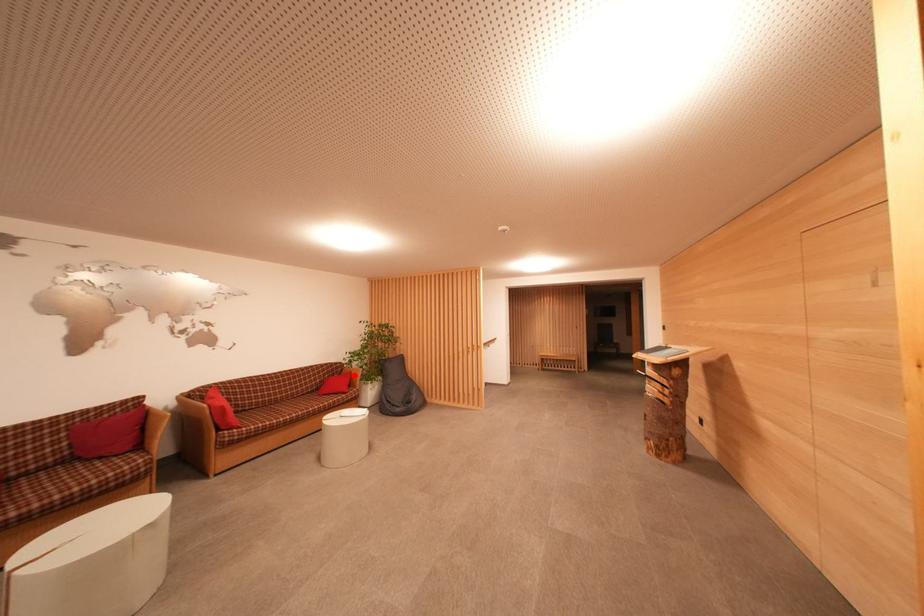
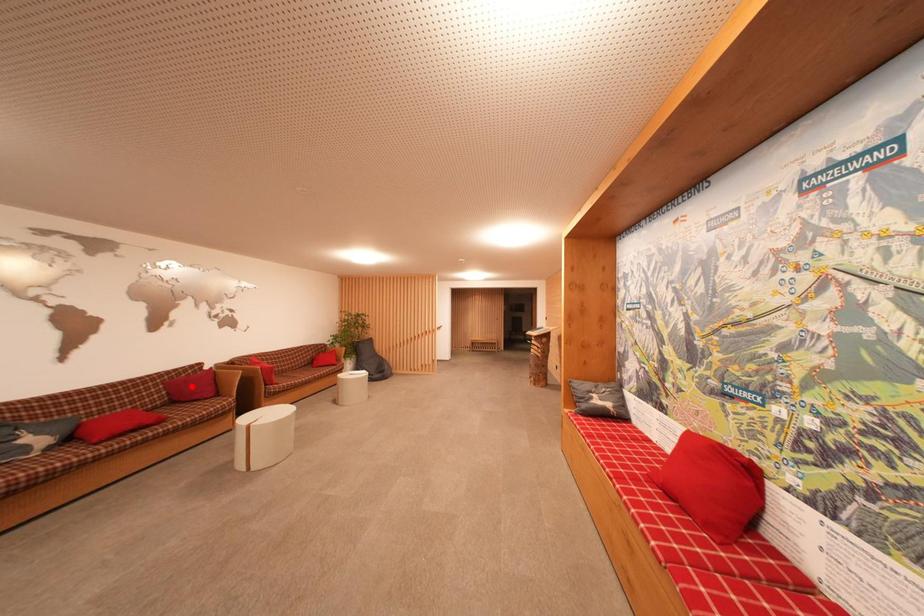
I am providing you with two images of the same scene from different viewpoints. A red point is marked on the first image and another point is marked on the second image. Is the marked point in image1 the same physical position as the marked point in image2?

→ No